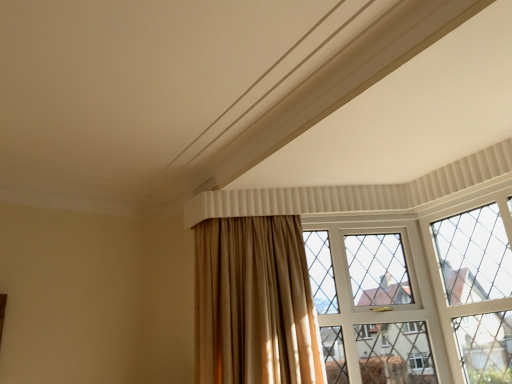
Question: Can you confirm if satin gold curtain at center is shorter than clear glass window at center?

Choices:
 (A) no
 (B) yes

Answer: (B)

Question: From the image's perspective, is satin gold curtain at center over clear glass window at center?

Choices:
 (A) yes
 (B) no

Answer: (A)

Question: Is satin gold curtain at center with clear glass window at center?

Choices:
 (A) no
 (B) yes

Answer: (A)

Question: Is satin gold curtain at center bigger than clear glass window at center?

Choices:
 (A) no
 (B) yes

Answer: (B)

Question: From the image's perspective, would you say satin gold curtain at center is shown under clear glass window at center?

Choices:
 (A) yes
 (B) no

Answer: (B)

Question: Is satin gold curtain at center positioned far away from clear glass window at center?

Choices:
 (A) no
 (B) yes

Answer: (A)

Question: Can you confirm if clear glass window at center is thinner than satin gold curtain at center?

Choices:
 (A) yes
 (B) no

Answer: (A)

Question: From a real-world perspective, is clear glass window at center under satin gold curtain at center?

Choices:
 (A) yes
 (B) no

Answer: (A)

Question: Considering the relative positions of clear glass window at center and satin gold curtain at center in the image provided, is clear glass window at center to the left of satin gold curtain at center from the viewer's perspective?

Choices:
 (A) yes
 (B) no

Answer: (B)

Question: Can you confirm if clear glass window at center is positioned to the right of satin gold curtain at center?

Choices:
 (A) yes
 (B) no

Answer: (A)

Question: Considering the relative sizes of clear glass window at center and satin gold curtain at center in the image provided, is clear glass window at center bigger than satin gold curtain at center?

Choices:
 (A) yes
 (B) no

Answer: (B)

Question: Is clear glass window at center wider than satin gold curtain at center?

Choices:
 (A) no
 (B) yes

Answer: (A)

Question: Would you say satin gold curtain at center is to the left or to the right of clear glass window at center in the picture?

Choices:
 (A) left
 (B) right

Answer: (A)